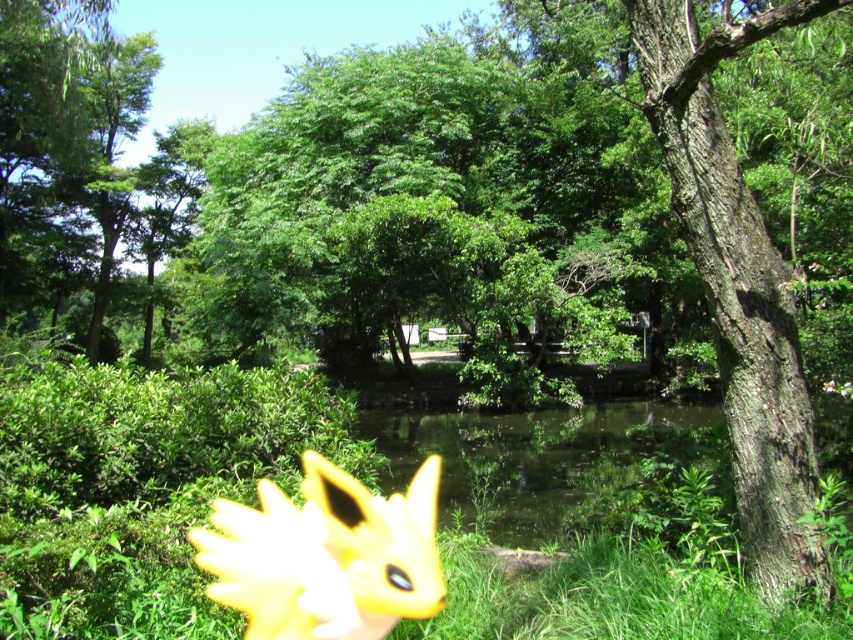
Based on the photo, who is positioned more to the right, yellow plush toy at lower left or clear water at center?

From the viewer's perspective, clear water at center appears more on the right side.

Locate an element on the screen. The width and height of the screenshot is (853, 640). yellow plush toy at lower left is located at coordinates (328, 556).

Find the location of `yellow plush toy at lower left`. yellow plush toy at lower left is located at coordinates (328, 556).

Is smooth brown bark at right positioned at the back of yellow plush toy at lower left?

That is False.

Can you confirm if smooth brown bark at right is taller than yellow plush toy at lower left?

Indeed, smooth brown bark at right has a greater height compared to yellow plush toy at lower left.

What do you see at coordinates (738, 284) in the screenshot? I see `smooth brown bark at right` at bounding box center [738, 284].

You are a GUI agent. You are given a task and a screenshot of the screen. Output one action in this format:
    pyautogui.click(x=<x>, y=<y>)
    Task: Click on the smooth brown bark at right
    The height and width of the screenshot is (640, 853).
    Given the screenshot: What is the action you would take?
    pyautogui.click(x=738, y=284)

Can you confirm if smooth brown bark at right is positioned to the left of clear water at center?

No, smooth brown bark at right is not to the left of clear water at center.

Is point (746, 291) behind point (680, 413)?

That is False.

Find the location of a particular element. The image size is (853, 640). smooth brown bark at right is located at coordinates (738, 284).

Find the location of a particular element. smooth brown bark at right is located at coordinates (x=738, y=284).